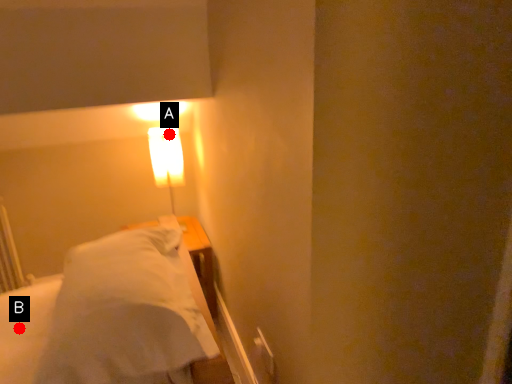
Question: Two points are circled on the image, labeled by A and B beside each circle. Which point is closer to the camera?

Choices:
 (A) A is closer
 (B) B is closer

Answer: (B)